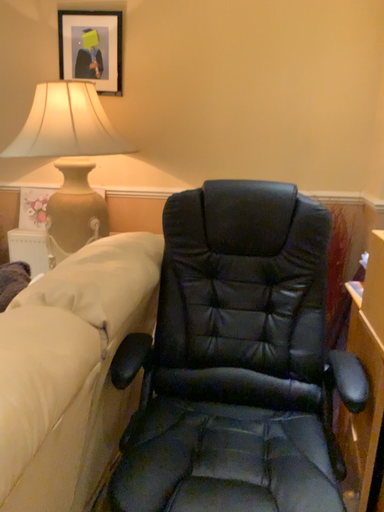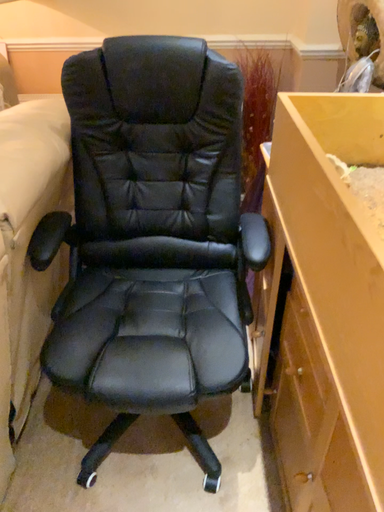
Question: Which way did the camera rotate in the video?

Choices:
 (A) rotated upward
 (B) rotated downward

Answer: (B)